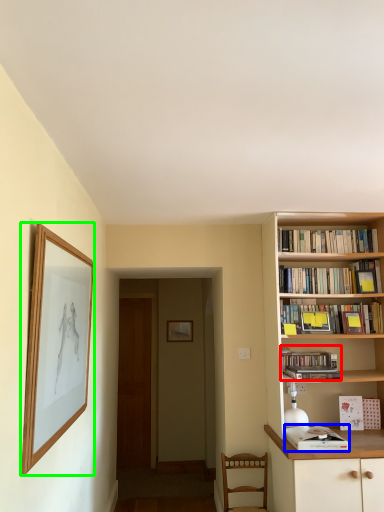
Question: Which object is the closest to the book (highlighted by a red box)? Choose among these: book (highlighted by a blue box) or picture frame (highlighted by a green box).

Choices:
 (A) book
 (B) picture frame

Answer: (A)